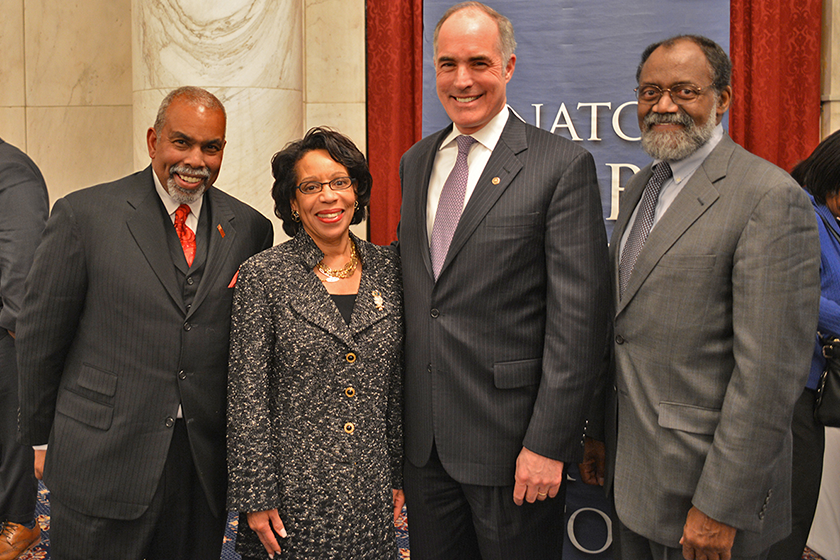
Find the location of a particular element. curtain is located at coordinates (401, 77), (756, 45).